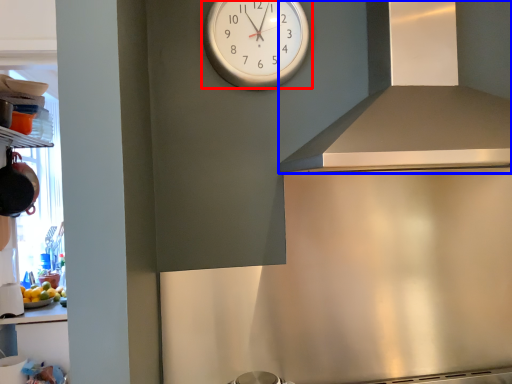
Question: Which object is further to the camera taking this photo, wall clock (highlighted by a red box) or exhaust hood (highlighted by a blue box)?

Choices:
 (A) wall clock
 (B) exhaust hood

Answer: (A)